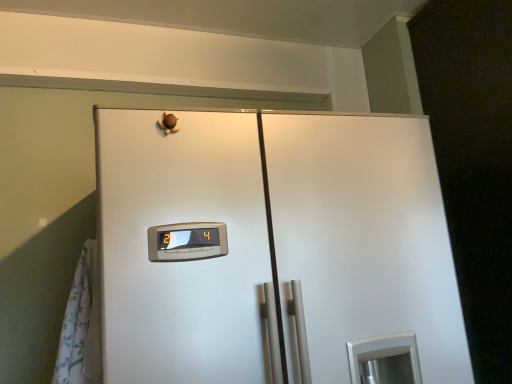
Question: From the image's perspective, is white floral fabric curtain at left located above or below satin white refrigerator at center?

Choices:
 (A) above
 (B) below

Answer: (A)

Question: From a real-world perspective, is white floral fabric curtain at left positioned above or below satin white refrigerator at center?

Choices:
 (A) below
 (B) above

Answer: (A)

Question: Is point [x=87, y=301] positioned closer to the camera than point [x=442, y=344]?

Choices:
 (A) closer
 (B) farther

Answer: (A)

Question: Based on their positions, is satin white refrigerator at center located to the left or right of white floral fabric curtain at left?

Choices:
 (A) right
 (B) left

Answer: (A)

Question: From the image's perspective, is satin white refrigerator at center positioned above or below white floral fabric curtain at left?

Choices:
 (A) above
 (B) below

Answer: (B)

Question: In the image, is satin white refrigerator at center positioned in front of or behind white floral fabric curtain at left?

Choices:
 (A) behind
 (B) front

Answer: (B)

Question: From a real-world perspective, relative to white floral fabric curtain at left, is satin white refrigerator at center vertically above or below?

Choices:
 (A) above
 (B) below

Answer: (A)